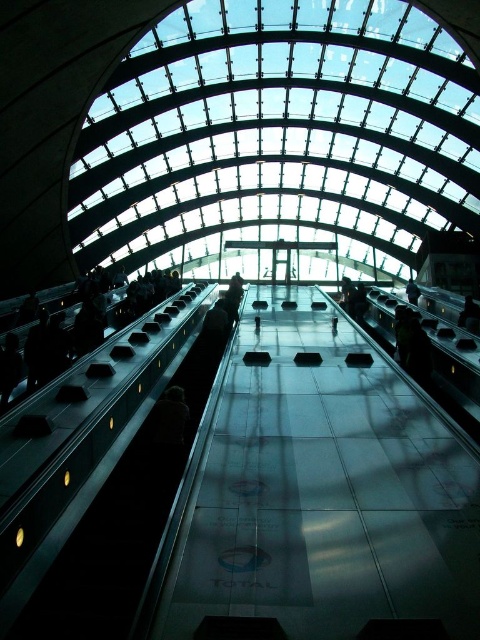
Question: Which point is farther to the camera?

Choices:
 (A) dark gray fabric person at center
 (B) metallic escalator at left

Answer: (A)

Question: Does metallic escalator at left appear over dark gray fabric person at center?

Choices:
 (A) no
 (B) yes

Answer: (A)

Question: Can you confirm if metallic escalator at left is positioned to the right of dark gray fabric person at center?

Choices:
 (A) yes
 (B) no

Answer: (A)

Question: Which point is farther to the camera?

Choices:
 (A) (13, 561)
 (B) (3, 353)

Answer: (B)

Question: Among these points, which one is nearest to the camera?

Choices:
 (A) (41, 541)
 (B) (0, 368)

Answer: (A)

Question: Is metallic escalator at left below dark gray fabric person at center?

Choices:
 (A) yes
 (B) no

Answer: (A)